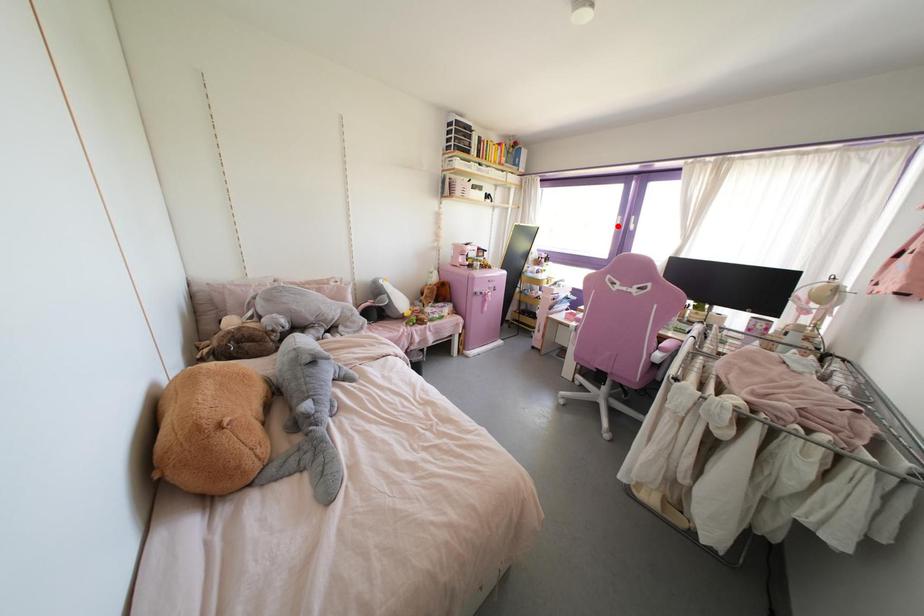
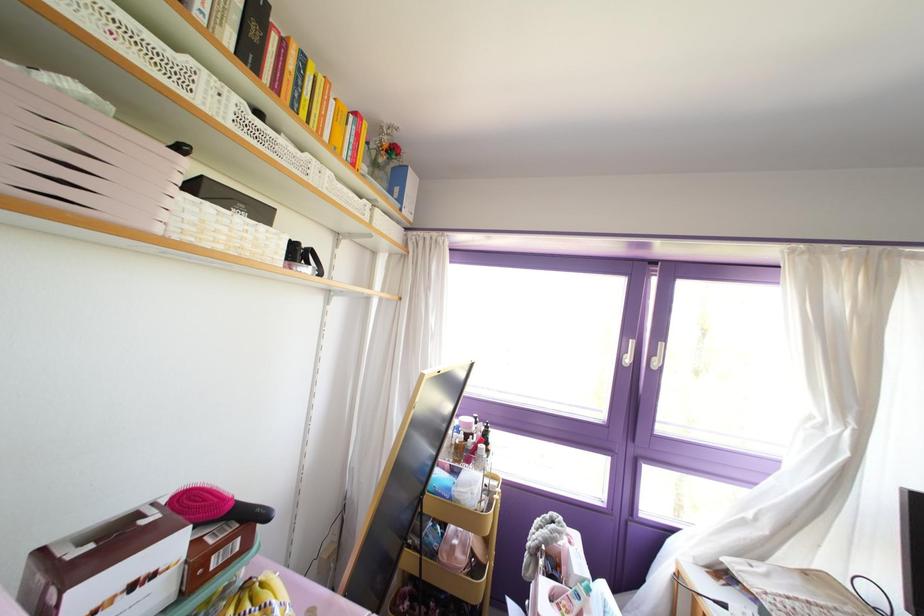
Question: A red point is marked in image1. In image2, is the corresponding 3D point closer to the camera or farther? Reply with the corresponding letter.

Choices:
 (A) The corresponding 3D point is closer.
 (B) The corresponding 3D point is farther.

Answer: (B)